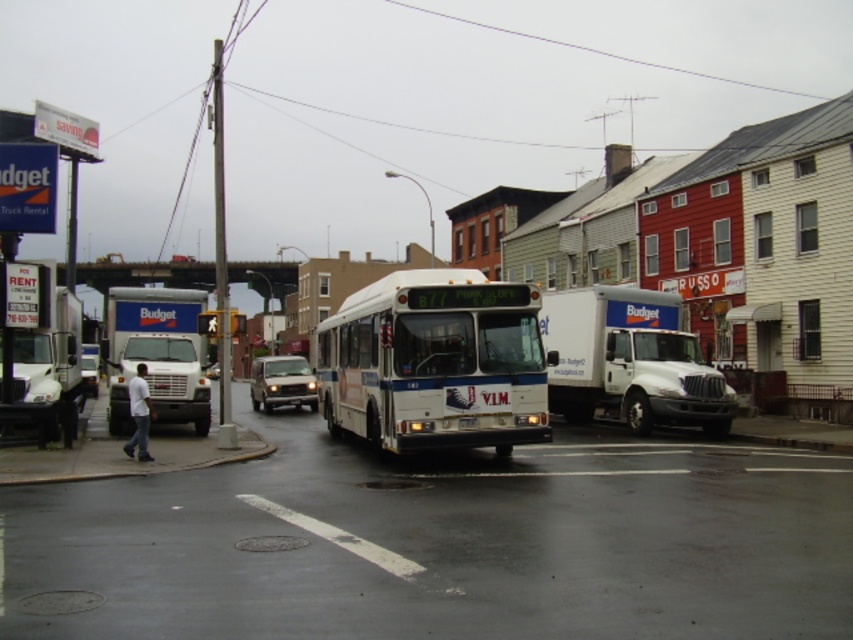
Question: Which of the following is the closest to the observer?

Choices:
 (A) white glossy bus at center
 (B) metallic silver suv at center
 (C) white plastic sign at upper left

Answer: (A)

Question: Which object is farther from the camera taking this photo?

Choices:
 (A) white glossy bus at center
 (B) white plastic license plate at center
 (C) white plastic sign at upper left
 (D) metallic silver suv at center

Answer: (D)

Question: Is white plastic sign at upper left thinner than white plastic license plate at center?

Choices:
 (A) no
 (B) yes

Answer: (A)

Question: Is white plastic sign at upper left to the right of white plastic license plate at center from the viewer's perspective?

Choices:
 (A) yes
 (B) no

Answer: (B)

Question: Which point is closer to the camera?

Choices:
 (A) (263, 368)
 (B) (463, 417)
 (C) (379, 353)

Answer: (B)

Question: Is white plastic sign at upper left wider than white plastic license plate at center?

Choices:
 (A) yes
 (B) no

Answer: (A)